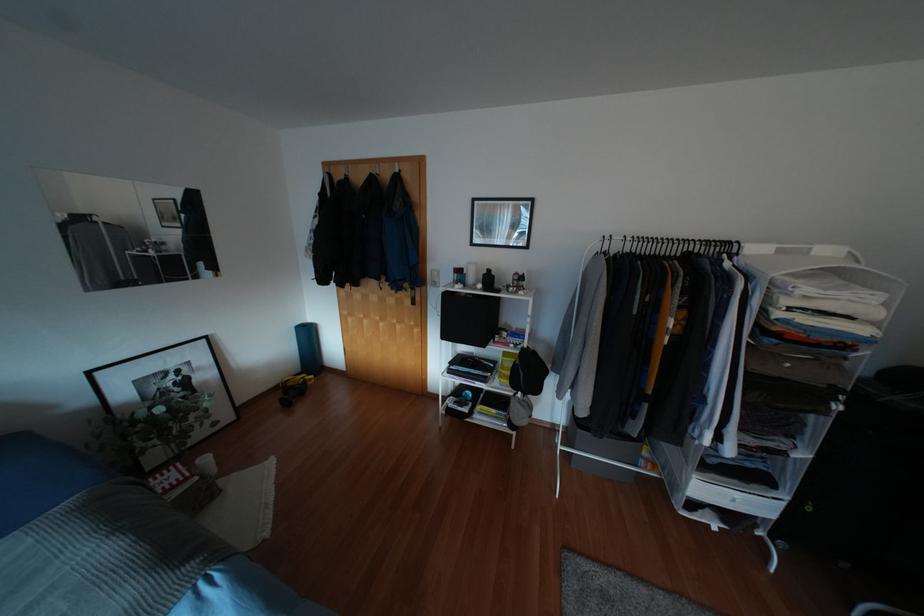
Where is `fabric drawer handle`? The width and height of the screenshot is (924, 616). fabric drawer handle is located at coordinates (733, 501).